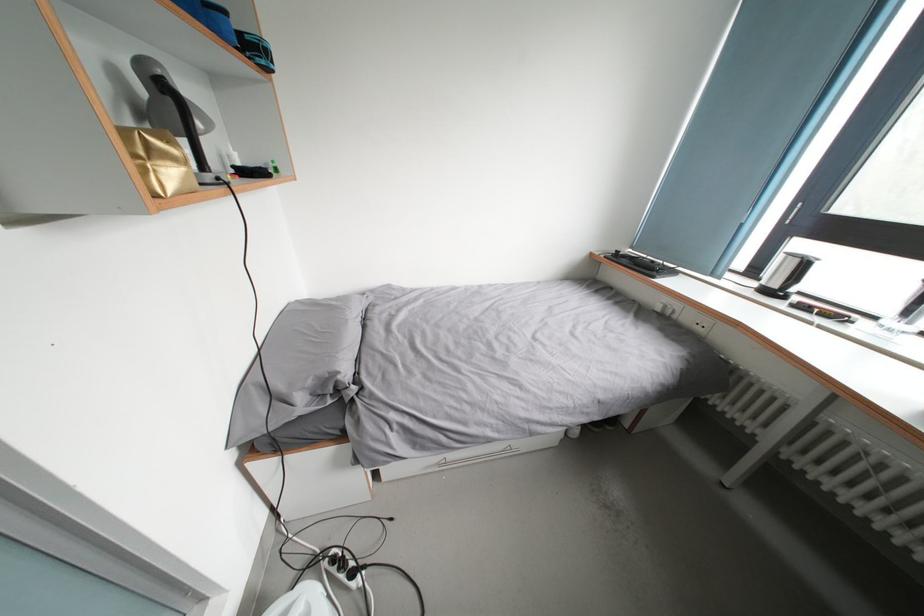
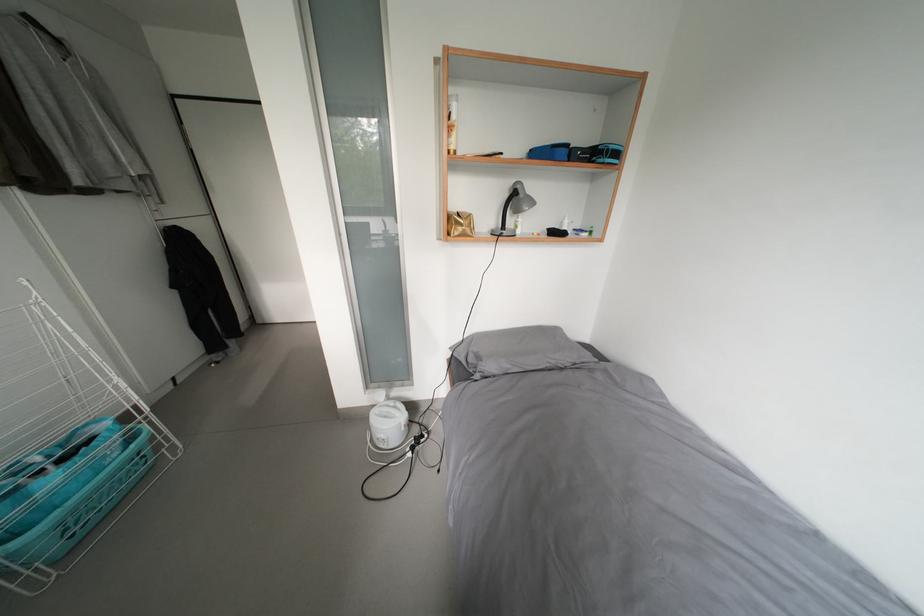
The images are taken continuously from a first-person perspective. In which direction is your viewpoint rotating?

The camera rotated toward left-down.